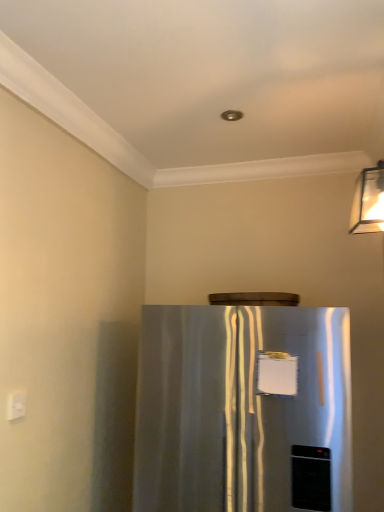
What do you see at coordinates (243, 409) in the screenshot? I see `satin silver refrigerator at center` at bounding box center [243, 409].

Locate an element on the screen. Image resolution: width=384 pixels, height=512 pixels. satin silver refrigerator at center is located at coordinates (243, 409).

Describe the element at coordinates (16, 405) in the screenshot. I see `white plastic electric outlet at lower left` at that location.

Locate an element on the screen. The width and height of the screenshot is (384, 512). white plastic electric outlet at lower left is located at coordinates (16, 405).

At what (x,y) coordinates should I click in order to perform the action: click on satin silver refrigerator at center. Please return your answer as a coordinate pair (x, y). The height and width of the screenshot is (512, 384). Looking at the image, I should click on (243, 409).

Considering the relative positions of satin silver refrigerator at center and white plastic electric outlet at lower left in the image provided, is satin silver refrigerator at center to the right of white plastic electric outlet at lower left from the viewer's perspective?

Yes, satin silver refrigerator at center is to the right of white plastic electric outlet at lower left.

Relative to white plastic electric outlet at lower left, is satin silver refrigerator at center in front or behind?

Clearly, satin silver refrigerator at center is in front of white plastic electric outlet at lower left.

Is point (257, 500) positioned behind point (10, 406)?

Yes, point (257, 500) is behind point (10, 406).

From the image's perspective, is satin silver refrigerator at center above or below white plastic electric outlet at lower left?

From the image's perspective, satin silver refrigerator at center appears below white plastic electric outlet at lower left.

From a real-world perspective, is satin silver refrigerator at center physically below white plastic electric outlet at lower left?

Indeed, from a real-world perspective, satin silver refrigerator at center is positioned beneath white plastic electric outlet at lower left.

Can you confirm if satin silver refrigerator at center is wider than white plastic electric outlet at lower left?

Correct, the width of satin silver refrigerator at center exceeds that of white plastic electric outlet at lower left.

Considering the relative sizes of satin silver refrigerator at center and white plastic electric outlet at lower left in the image provided, is satin silver refrigerator at center shorter than white plastic electric outlet at lower left?

In fact, satin silver refrigerator at center may be taller than white plastic electric outlet at lower left.

Which of these two, satin silver refrigerator at center or white plastic electric outlet at lower left, is smaller?

Smaller between the two is white plastic electric outlet at lower left.

Is satin silver refrigerator at center not within white plastic electric outlet at lower left?

Absolutely, satin silver refrigerator at center is external to white plastic electric outlet at lower left.

Is satin silver refrigerator at center far away from white plastic electric outlet at lower left?

satin silver refrigerator at center is actually quite close to white plastic electric outlet at lower left.

Is satin silver refrigerator at center facing towards white plastic electric outlet at lower left?

No, satin silver refrigerator at center is not aimed at white plastic electric outlet at lower left.

What's the angular difference between satin silver refrigerator at center and white plastic electric outlet at lower left's facing directions?

They differ by 91.8 degrees in their facing directions.

Could you measure the distance between satin silver refrigerator at center and white plastic electric outlet at lower left?

89.85 centimeters.

Find the location of a particular element. The image size is (384, 512). electric outlet behind the satin silver refrigerator at center is located at coordinates (16, 405).

Considering the relative positions of white plastic electric outlet at lower left and satin silver refrigerator at center in the image provided, is white plastic electric outlet at lower left to the left or to the right of satin silver refrigerator at center?

Clearly, white plastic electric outlet at lower left is on the left of satin silver refrigerator at center in the image.

Between white plastic electric outlet at lower left and satin silver refrigerator at center, which one is positioned behind?

white plastic electric outlet at lower left is behind.

Considering the points (16, 414) and (161, 381), which point is behind, point (16, 414) or point (161, 381)?

The point (161, 381) is behind.

From the image's perspective, does white plastic electric outlet at lower left appear higher than satin silver refrigerator at center?

Indeed, from the image's perspective, white plastic electric outlet at lower left is shown above satin silver refrigerator at center.

From a real-world perspective, which object rests below the other?

In real-world perspective, satin silver refrigerator at center is lower.

Which of these two, white plastic electric outlet at lower left or satin silver refrigerator at center, is thinner?

With smaller width is white plastic electric outlet at lower left.

Considering the sizes of objects white plastic electric outlet at lower left and satin silver refrigerator at center in the image provided, who is taller, white plastic electric outlet at lower left or satin silver refrigerator at center?

satin silver refrigerator at center.

Can you confirm if white plastic electric outlet at lower left is smaller than satin silver refrigerator at center?

Indeed, white plastic electric outlet at lower left has a smaller size compared to satin silver refrigerator at center.

Consider the image. Is white plastic electric outlet at lower left spatially inside satin silver refrigerator at center, or outside of it?

white plastic electric outlet at lower left is not enclosed by satin silver refrigerator at center.

Can you see white plastic electric outlet at lower left touching satin silver refrigerator at center?

No.

Could you tell me if white plastic electric outlet at lower left is turned towards satin silver refrigerator at center?

No, white plastic electric outlet at lower left is not aimed at satin silver refrigerator at center.

How far apart are white plastic electric outlet at lower left and satin silver refrigerator at center?

white plastic electric outlet at lower left and satin silver refrigerator at center are 35.37 inches apart.

I want to click on refrigerator located in front of the white plastic electric outlet at lower left, so pos(243,409).

Find the location of `electric outlet behind the satin silver refrigerator at center`. electric outlet behind the satin silver refrigerator at center is located at coordinates (16, 405).

Locate an element on the screen. The height and width of the screenshot is (512, 384). refrigerator in front of the white plastic electric outlet at lower left is located at coordinates (243, 409).